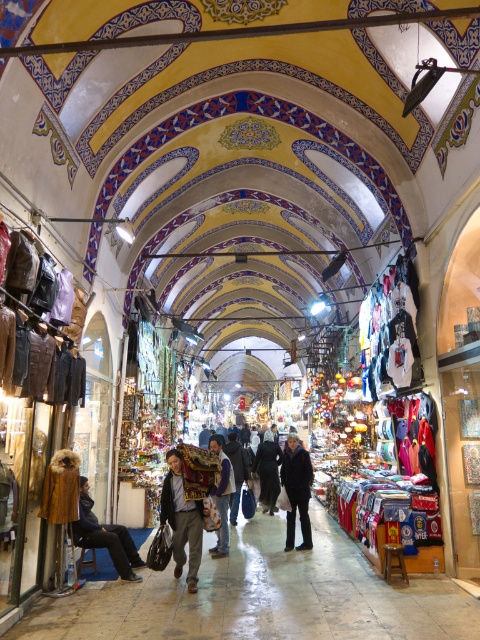
You are standing in the bazaar and want to take a photo of both point (180,536) and point (95,545). Which point should you focus on first to ensure both are in clear view?

You should focus on point (180,536) first because it is closer to the camera than point (95,545), ensuring both points are in focus when using a camera with a fixed focal plane.